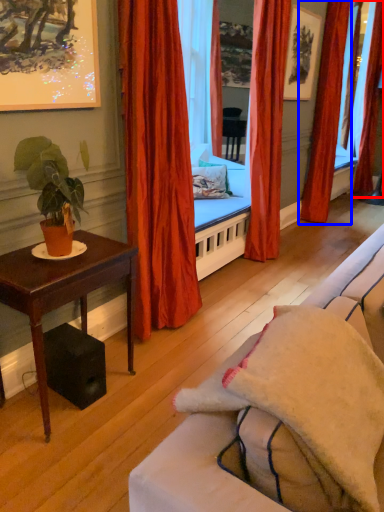
Question: Which of the following is the farthest to the observer, curtain (highlighted by a red box) or curtain (highlighted by a blue box)?

Choices:
 (A) curtain
 (B) curtain

Answer: (A)